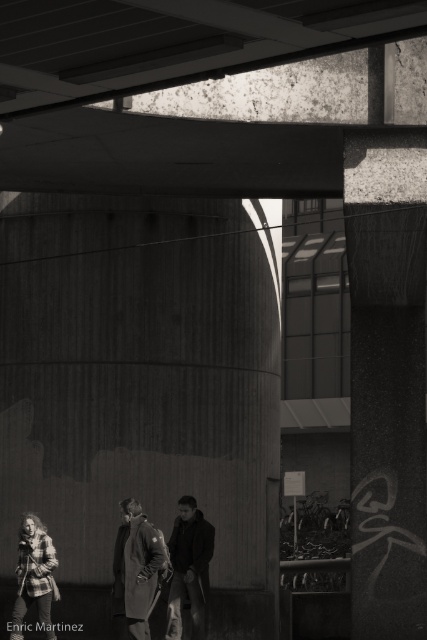
Between coarse wool coat at center and dark wool coat at center, which one is positioned higher?

coarse wool coat at center is above.

Looking at this image, is coarse wool coat at center below dark wool coat at center?

No, coarse wool coat at center is not below dark wool coat at center.

Locate an element on the screen. Image resolution: width=427 pixels, height=640 pixels. coarse wool coat at center is located at coordinates (137, 568).

Which is below, dark wool coat at center or plaid flannel shirt at lower left?

plaid flannel shirt at lower left

At what (x,y) coordinates should I click in order to perform the action: click on dark wool coat at center. Please return your answer as a coordinate pair (x, y). The width and height of the screenshot is (427, 640). Looking at the image, I should click on (189, 568).

Identify the location of dark wool coat at center. The image size is (427, 640). (189, 568).

Is coarse wool coat at center taller than plaid flannel shirt at lower left?

Correct, coarse wool coat at center is much taller as plaid flannel shirt at lower left.

Does coarse wool coat at center have a greater width compared to plaid flannel shirt at lower left?

Correct, the width of coarse wool coat at center exceeds that of plaid flannel shirt at lower left.

I want to click on coarse wool coat at center, so click(137, 568).